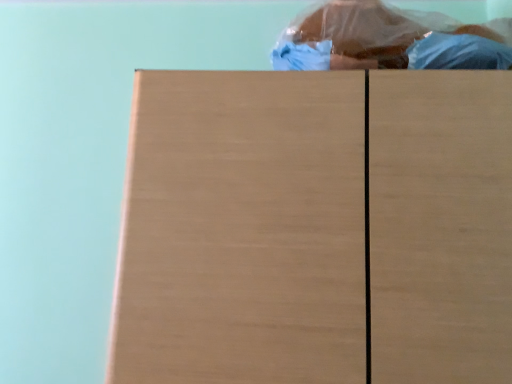
Describe the element at coordinates (365, 35) in the screenshot. This screenshot has height=384, width=512. I see `blue plastic bag at upper center` at that location.

Measure the distance between point (293, 37) and camera.

Point (293, 37) is 3.69 feet from camera.

Identify the location of blue plastic bag at upper center. Image resolution: width=512 pixels, height=384 pixels. [x=365, y=35].

The image size is (512, 384). Describe the element at coordinates (316, 228) in the screenshot. I see `light brown wood at center` at that location.

Find the location of a particular element. The width and height of the screenshot is (512, 384). light brown wood at center is located at coordinates (316, 228).

Identify the location of blue plastic bag at upper center. The width and height of the screenshot is (512, 384). (365, 35).

Looking at this image, is light brown wood at center to the left of blue plastic bag at upper center from the viewer's perspective?

Indeed, light brown wood at center is positioned on the left side of blue plastic bag at upper center.

Is light brown wood at center behind blue plastic bag at upper center?

No, light brown wood at center is closer to the viewer.

Is point (506, 119) closer or farther from the camera than point (353, 35)?

Point (506, 119).

From the image's perspective, which object appears higher, light brown wood at center or blue plastic bag at upper center?

blue plastic bag at upper center appears higher in the image.

From a real-world perspective, is light brown wood at center on top of blue plastic bag at upper center?

Actually, light brown wood at center is physically below blue plastic bag at upper center in the real world.

Is light brown wood at center thinner than blue plastic bag at upper center?

No, light brown wood at center is not thinner than blue plastic bag at upper center.

Is light brown wood at center taller than blue plastic bag at upper center?

Correct, light brown wood at center is much taller as blue plastic bag at upper center.

In the scene shown: Who is smaller, light brown wood at center or blue plastic bag at upper center?

blue plastic bag at upper center.

Which is correct: light brown wood at center is inside blue plastic bag at upper center, or outside of it?

light brown wood at center is not inside blue plastic bag at upper center, it's outside.

Is light brown wood at center next to blue plastic bag at upper center and touching it?

light brown wood at center and blue plastic bag at upper center are not in contact.

Is light brown wood at center aimed at blue plastic bag at upper center?

No, light brown wood at center is not turned towards blue plastic bag at upper center.

How many degrees apart are the facing directions of light brown wood at center and blue plastic bag at upper center?

There is a 2.65e-05-degree angle between the facing directions of light brown wood at center and blue plastic bag at upper center.

Measure the distance from light brown wood at center to blue plastic bag at upper center.

light brown wood at center is 15.11 inches from blue plastic bag at upper center.

The image size is (512, 384). What are the coordinates of `person behind the light brown wood at center` in the screenshot? It's located at (365, 35).

Based on their positions, is blue plastic bag at upper center located to the left or right of light brown wood at center?

In the image, blue plastic bag at upper center appears on the right side of light brown wood at center.

Is blue plastic bag at upper center positioned before light brown wood at center?

No, it is behind light brown wood at center.

Considering the positions of points (298, 43) and (148, 83), is point (298, 43) farther from camera compared to point (148, 83)?

Yes, point (298, 43) is behind point (148, 83).

Consider the image. From the image's perspective, which one is positioned higher, blue plastic bag at upper center or light brown wood at center?

blue plastic bag at upper center is shown above in the image.

From a real-world perspective, is blue plastic bag at upper center on top of light brown wood at center?

Yes, from a real-world perspective, blue plastic bag at upper center is above light brown wood at center.

Can you confirm if blue plastic bag at upper center is wider than light brown wood at center?

No, blue plastic bag at upper center is not wider than light brown wood at center.

From their relative heights in the image, would you say blue plastic bag at upper center is taller or shorter than light brown wood at center?

Considering their sizes, blue plastic bag at upper center has less height than light brown wood at center.

Which of these two, blue plastic bag at upper center or light brown wood at center, is bigger?

light brown wood at center.

Is blue plastic bag at upper center not within light brown wood at center?

blue plastic bag at upper center lies outside light brown wood at center's area.

Are blue plastic bag at upper center and light brown wood at center located far from each other?

Actually, blue plastic bag at upper center and light brown wood at center are a little close together.

Is blue plastic bag at upper center aimed at light brown wood at center?

No, blue plastic bag at upper center is not facing towards light brown wood at center.

Can you tell me how much blue plastic bag at upper center and light brown wood at center differ in facing direction?

There is a 2.65e-05-degree angle between the facing directions of blue plastic bag at upper center and light brown wood at center.

Identify the location of wood in front of the blue plastic bag at upper center. Image resolution: width=512 pixels, height=384 pixels. (316, 228).

Image resolution: width=512 pixels, height=384 pixels. Identify the location of wood that appears below the blue plastic bag at upper center (from the image's perspective). (316, 228).

This screenshot has width=512, height=384. In order to click on wood below the blue plastic bag at upper center (from a real-world perspective) in this screenshot , I will do `click(316, 228)`.